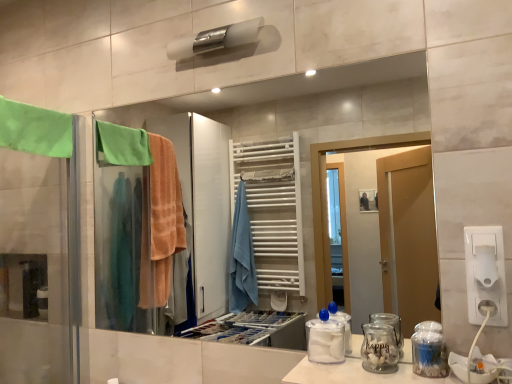
Locate an element on the screen. The width and height of the screenshot is (512, 384). free location to the left of clear glass jar at lower right, which is the 2th glass jar in right-to-left order is located at coordinates (332, 370).